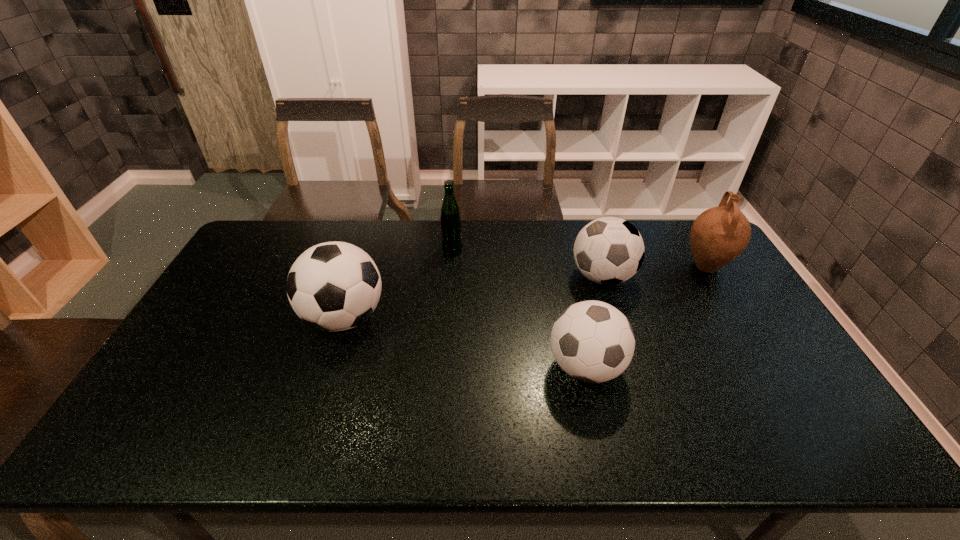
Where is `object present at the far right corner`? The width and height of the screenshot is (960, 540). object present at the far right corner is located at coordinates (719, 235).

Locate an element on the screen. vacant space at the far edge of the desktop is located at coordinates (429, 244).

Find the location of a particular element. Image resolution: width=960 pixels, height=540 pixels. free space at the left edge of the desktop is located at coordinates (151, 404).

You are a GUI agent. You are given a task and a screenshot of the screen. Output one action in this format:
    pyautogui.click(x=<x>, y=<y>)
    Task: Click on the free space at the right edge
    
    Given the screenshot: What is the action you would take?
    pyautogui.click(x=700, y=283)

This screenshot has width=960, height=540. Find the location of `free region at the far left corner of the desktop`. free region at the far left corner of the desktop is located at coordinates (252, 253).

This screenshot has width=960, height=540. I want to click on vacant space in between the rightmost object and the leftmost object, so click(525, 292).

Find the location of `vacant region between the beer bottle and the leftmost object`. vacant region between the beer bottle and the leftmost object is located at coordinates (398, 284).

Find the location of `the second closest object relative to the rightmost object`. the second closest object relative to the rightmost object is located at coordinates (592, 341).

Image resolution: width=960 pixels, height=540 pixels. What are the coordinates of `object that stands as the fourth closest to the pitcher` in the screenshot? It's located at (334, 286).

Identify the location of soccer ball object that ranks as the second closest to the leftmost soccer ball. (609, 250).